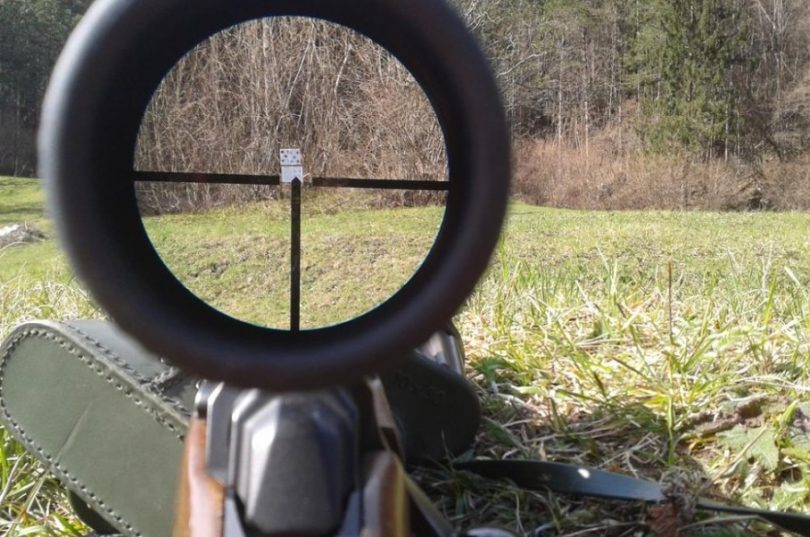
Where is `handle`? This screenshot has height=537, width=810. handle is located at coordinates (385, 500).